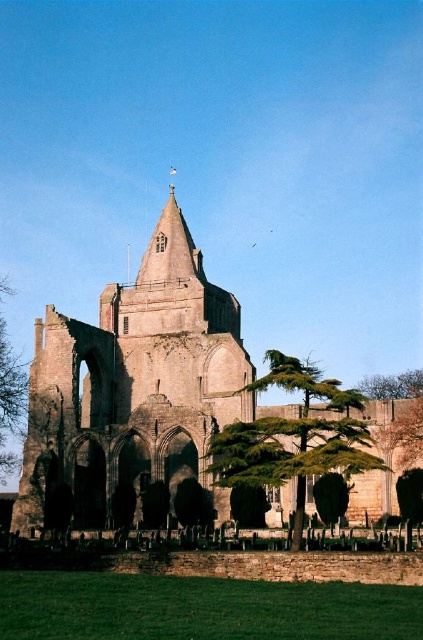
Is stone steeple at center wider than green textured stone tree at center?

Yes, stone steeple at center is wider than green textured stone tree at center.

Is stone steeple at center in front of green textured stone tree at center?

No, it is behind green textured stone tree at center.

Which is in front, point (142, 362) or point (348, 429)?

Point (348, 429) is more forward.

Find the location of a particular element. This screenshot has height=640, width=423. stone steeple at center is located at coordinates (134, 384).

Is stone steeple at center positioned behind green leafy tree at lower right?

No, it is not.

Can you confirm if stone steeple at center is positioned below green leafy tree at lower right?

No.

Between point (186, 310) and point (373, 396), which one is positioned behind?

The point (373, 396) is behind.

This screenshot has height=640, width=423. I want to click on stone steeple at center, so click(134, 384).

Is green textured stone tree at center above green leafy tree at left?

Yes.

The image size is (423, 640). Identify the location of green textured stone tree at center. (294, 436).

Does point (326, 444) lie in front of point (7, 460)?

Yes, point (326, 444) is closer to viewer.

You are a GUI agent. You are given a task and a screenshot of the screen. Output one action in this format:
    pyautogui.click(x=<x>, y=<y>)
    Task: Click on the green textured stone tree at center
    
    Given the screenshot: What is the action you would take?
    pyautogui.click(x=294, y=436)